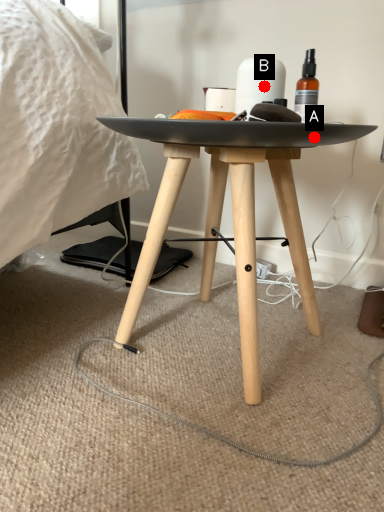
Question: Two points are circled on the image, labeled by A and B beside each circle. Which point is further to the camera?

Choices:
 (A) A is further
 (B) B is further

Answer: (B)